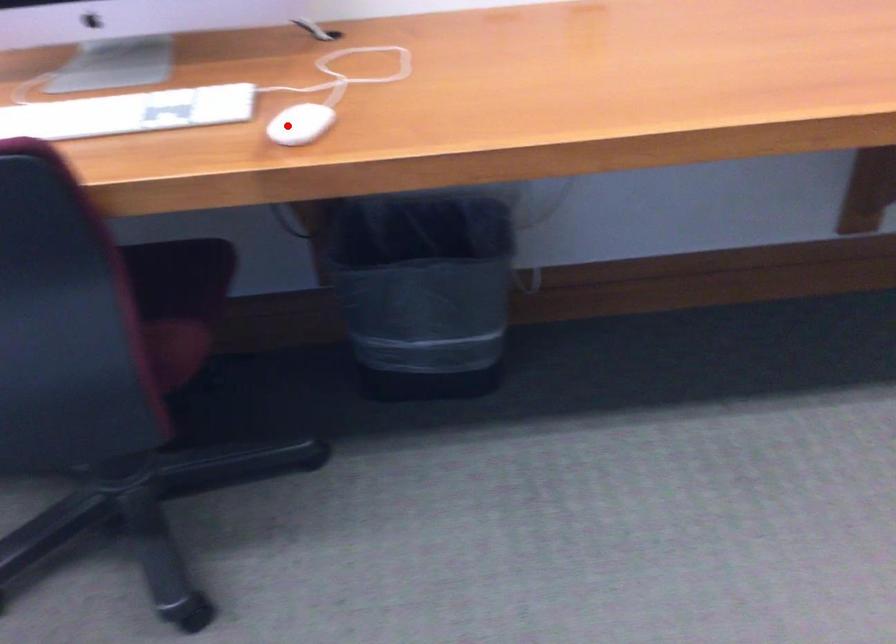
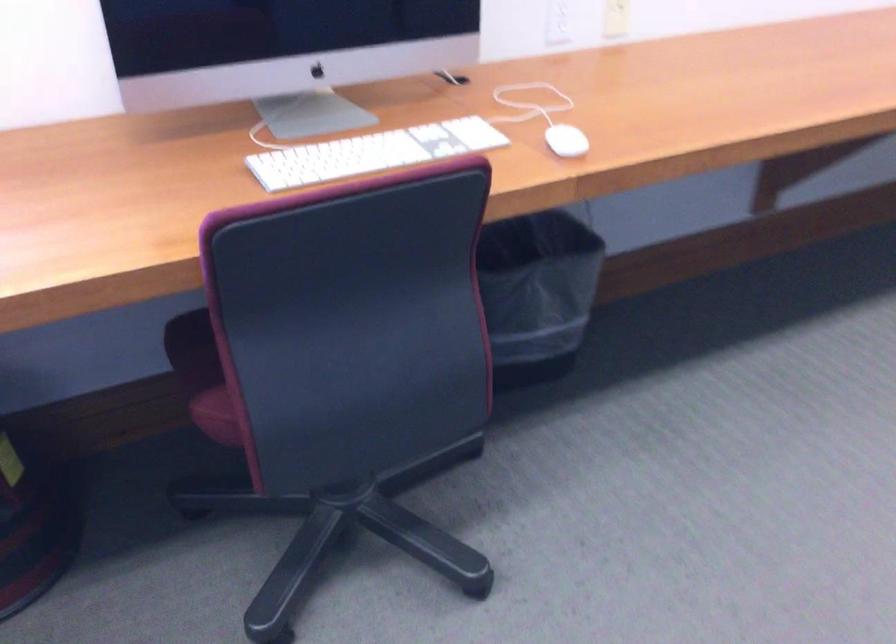
In the second image, find the point that corresponds to the highlighted location in the first image.

(565, 140)